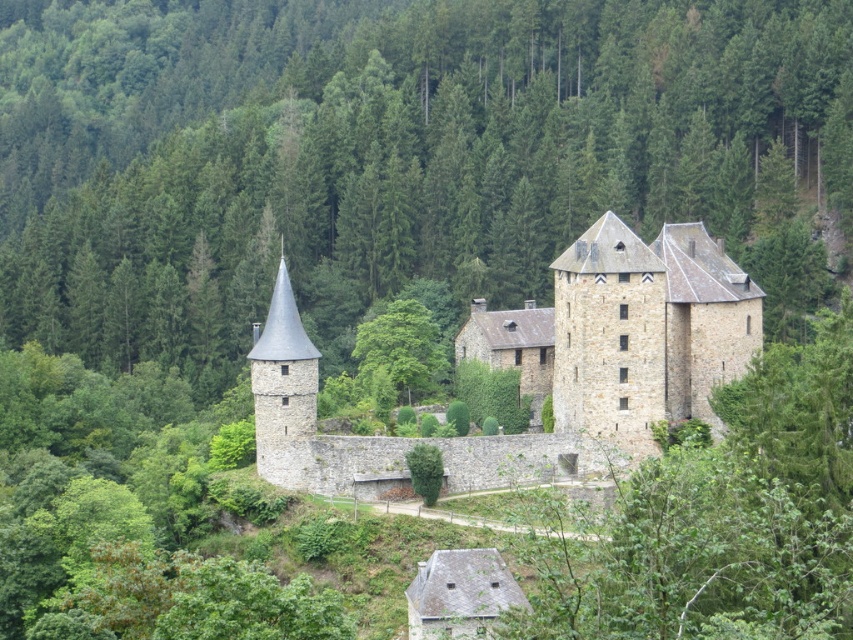
You are a bird soaring above the medieval castle. You spot a green leafy tree at center and a stone spire at left. Which object is higher in the sky from your perspective?

The green leafy tree at center is located above the stone spire at left, so from the bird perspective, the green leafy tree at center is higher in the sky.

You are a knight standing in the courtyard of the castle. You notice a green leafy tree at center and a stone spire at left. Which object would block your view more if you were to stand directly in front of them?

The green leafy tree at center is larger in size than the stone spire at left, so it would block your view more if you were to stand directly in front of them.

You are standing at a viewpoint overlooking the stone castle at center. If you want to take a photo of the castle with your camera, will you be able to capture the entire structure in one shot without moving closer?

The stone castle at center is 313.98 feet away from the camera. Whether you can capture the entire structure depends on your camera lens. A standard lens might require moving closer, but a wide angle lens could potentially capture the whole castle from that distance.